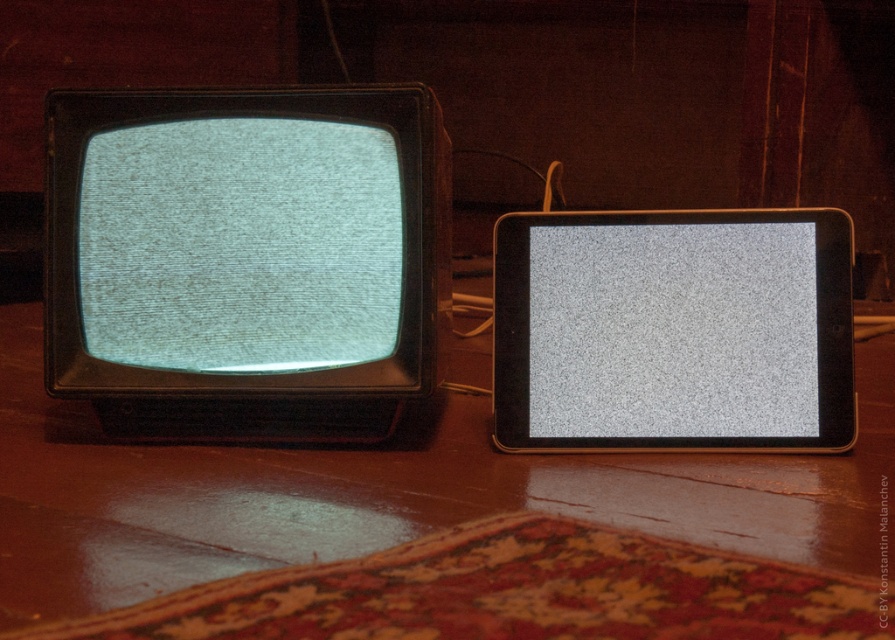
Question: Can you confirm if teal matte screen at left is smaller than gray matte screen at center?

Choices:
 (A) no
 (B) yes

Answer: (A)

Question: Based on their relative distances, which object is farther from the gray matte screen at center?

Choices:
 (A) teal matte screen at left
 (B) wooden table at center

Answer: (A)

Question: Based on their relative distances, which object is nearer to the teal matte screen at left?

Choices:
 (A) wooden table at center
 (B) gray matte screen at center

Answer: (A)

Question: Which of these objects is positioned closest to the wooden table at center?

Choices:
 (A) gray matte screen at center
 (B) teal matte screen at left

Answer: (A)

Question: Does teal matte screen at left appear under gray matte screen at center?

Choices:
 (A) no
 (B) yes

Answer: (A)

Question: Is teal matte screen at left positioned behind gray matte screen at center?

Choices:
 (A) no
 (B) yes

Answer: (A)